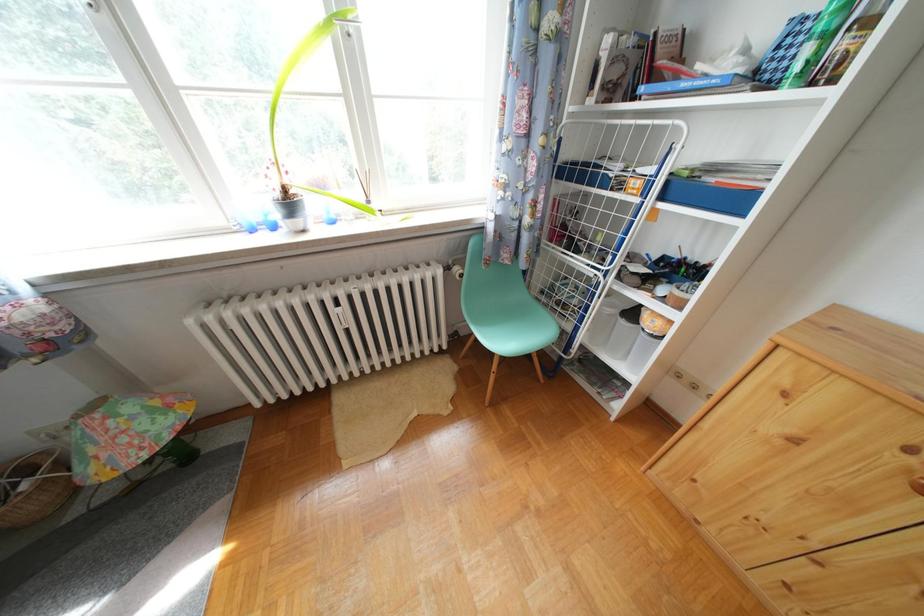
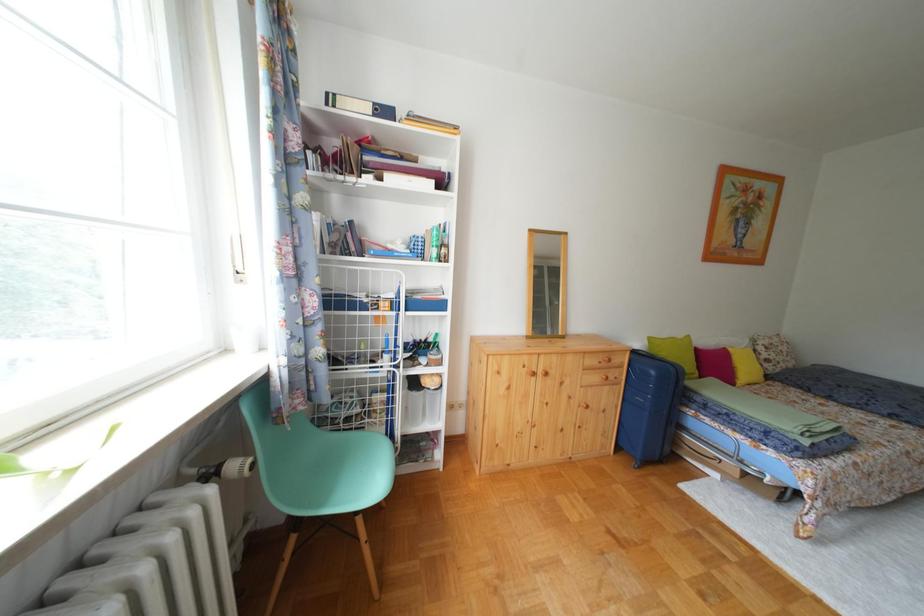
Question: The first image is from the beginning of the video and the second image is from the end. How did the camera likely rotate when shooting the video?

Choices:
 (A) Left
 (B) Right
 (C) Up
 (D) Down

Answer: (B)